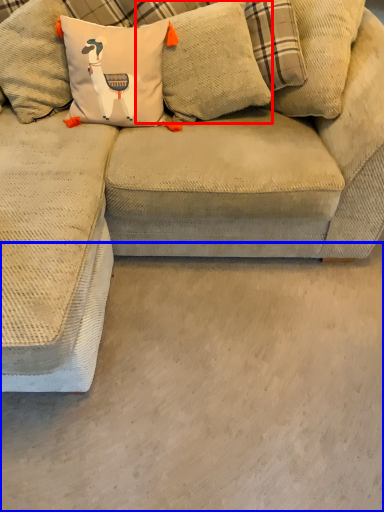
Question: Which point is further to the camera, pillow (highlighted by a red box) or concrete (highlighted by a blue box)?

Choices:
 (A) pillow
 (B) concrete

Answer: (A)